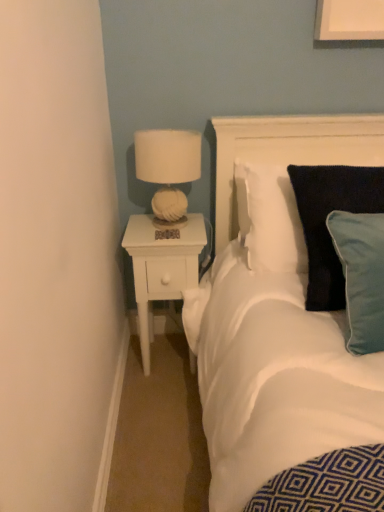
Where is `blank space situated above white wood nightstand at left (from a real-world perspective)`? The width and height of the screenshot is (384, 512). blank space situated above white wood nightstand at left (from a real-world perspective) is located at coordinates (162, 225).